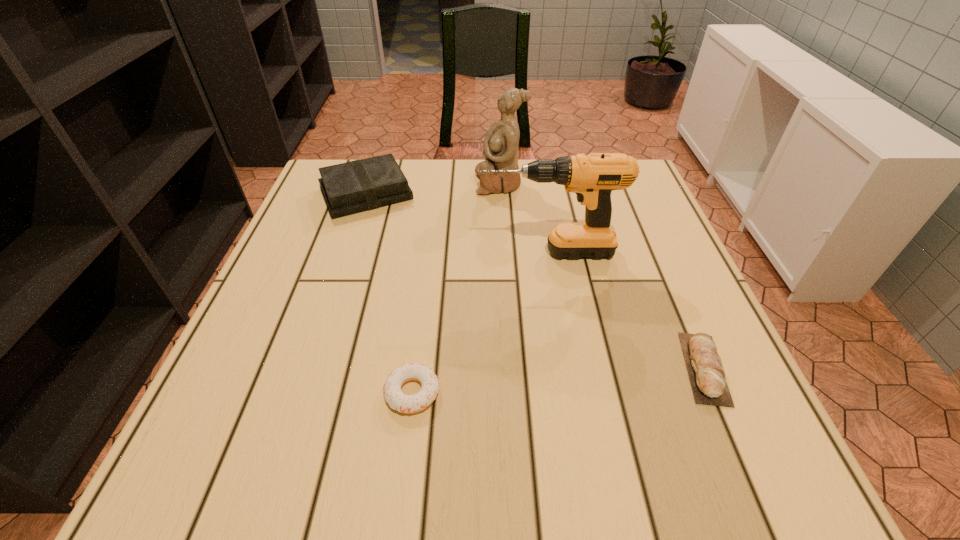
I want to click on vacant region located on the front-facing side of the figurine, so click(x=345, y=183).

You are a GUI agent. You are given a task and a screenshot of the screen. Output one action in this format:
    pyautogui.click(x=<x>, y=<y>)
    Task: Click on the free region located at the tip of the third nearest object
    The image size is (960, 540).
    Given the screenshot: What is the action you would take?
    pyautogui.click(x=420, y=252)

What are the coordinates of `vacant region located 0.290m at the tip of the third nearest object` in the screenshot? It's located at (348, 252).

At what (x,y) coordinates should I click in order to perform the action: click on vacant area situated 0.180m at the tip of the third nearest object. Please return your answer as a coordinate pair (x, y). The image size is (960, 540). Looking at the image, I should click on (397, 252).

Image resolution: width=960 pixels, height=540 pixels. What are the coordinates of `vacant space situated 0.170m on the right of the third shortest object` in the screenshot? It's located at (480, 193).

At what (x,y) coordinates should I click in order to perform the action: click on vacant space located on the left of the pita bread. Please return your answer as a coordinate pair (x, y). Looking at the image, I should click on (554, 368).

At what (x,y) coordinates should I click in order to perform the action: click on blank area located 0.230m on the left of the fourth object from right to left. Please return your answer as a coordinate pair (x, y). The width and height of the screenshot is (960, 540). Looking at the image, I should click on (245, 393).

This screenshot has height=540, width=960. Identify the location of figurine that is positioned at the far edge. (501, 142).

You are a GUI agent. You are given a task and a screenshot of the screen. Output one action in this format:
    pyautogui.click(x=<x>, y=<y>)
    Task: Click on the book that is at the far edge
    
    Given the screenshot: What is the action you would take?
    pyautogui.click(x=355, y=186)

Identify the location of object positioned at the left edge. (355, 186).